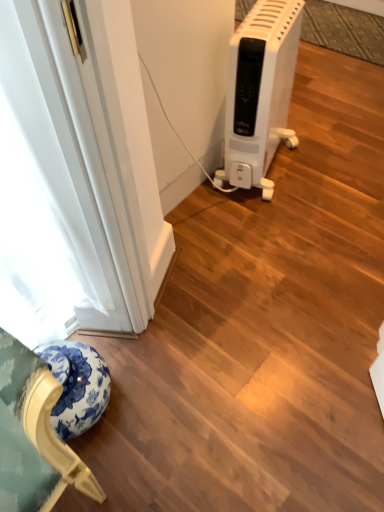
Locate an element on the screen. The height and width of the screenshot is (512, 384). free point behind blue and white ceramic swivel chair at lower left is located at coordinates click(x=106, y=339).